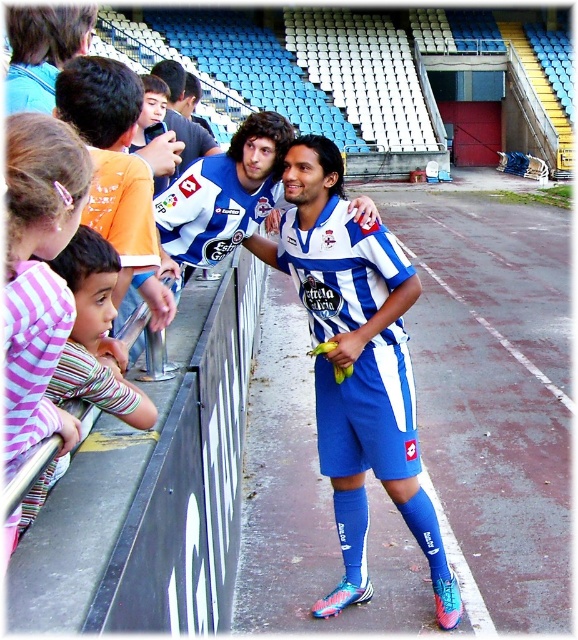
You are standing at the soccer stadium and want to know which of the two points, point (381, 368) or point (380, 369), is closer to you. Can you determine this based on their positions?

Point (381, 368) is further to the viewer than point (380, 369), so point (380, 369) is closer to you.